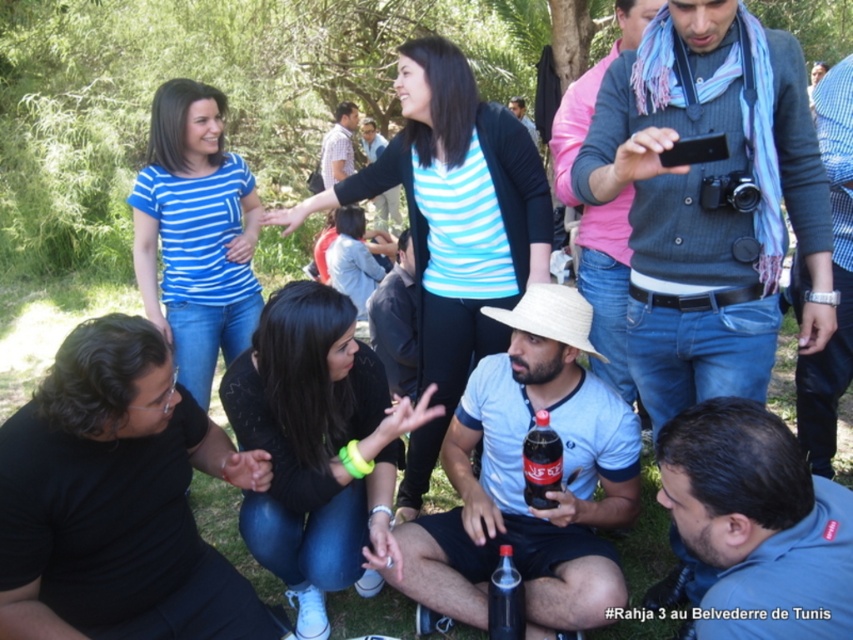
Question: Is the position of black glass bottle at center less distant than that of white striped shirt at upper center?

Choices:
 (A) yes
 (B) no

Answer: (A)

Question: Which of the following is the farthest from the observer?

Choices:
 (A) light blue shirt at center
 (B) light blue striped shirt at center
 (C) dark red glass coca-cola at center
 (D) blue sweater at upper right

Answer: (A)

Question: Which point is closer to the camera?

Choices:
 (A) white striped shirt at upper center
 (B) black matte shirt at lower left

Answer: (B)

Question: Is black matte shirt at lower left above light blue shirt at center?

Choices:
 (A) no
 (B) yes

Answer: (A)

Question: Is black matte shirt at lower left wider than light blue shirt at center?

Choices:
 (A) yes
 (B) no

Answer: (A)

Question: Which point is closer to the camera taking this photo?

Choices:
 (A) (537, 144)
 (B) (544, 476)
 (C) (569, 312)

Answer: (B)